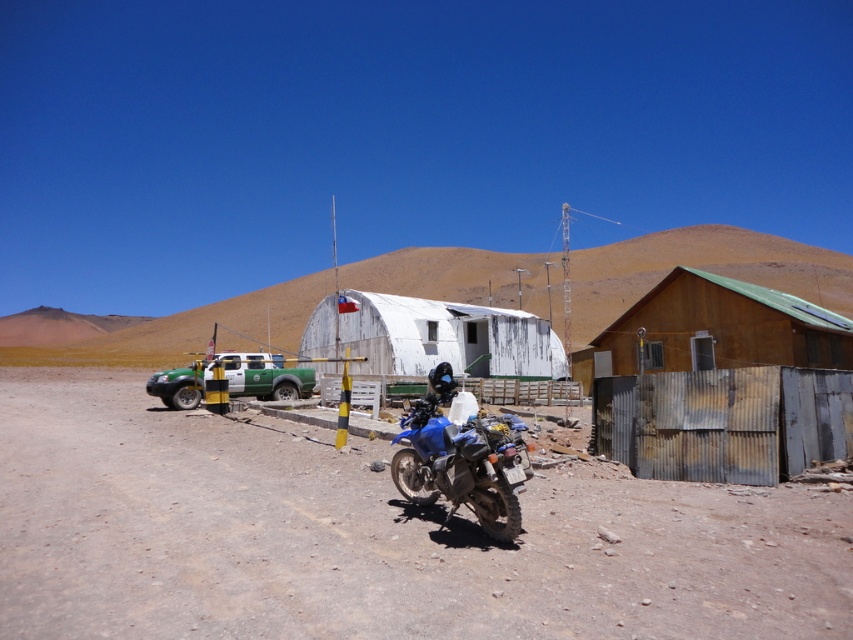
You are a traveler on foot in this desert area. You see the dusty gravel road at center and the blue matte motorcycle at center. Which object is closer to you as you stand on the road?

The dusty gravel road at center is positioned under the blue matte motorcycle at center, so the motorcycle is closer to you than the road.

In the scene shown: You are a delivery driver trying to pass a blue matte motorcycle at center parked on the dusty gravel road at center. Can your truck, which is 2 meters wide, safely pass the motorcycle on the same road?

The dusty gravel road at center might be wider than blue matte motorcycle at center, so there is a possibility that the truck can pass safely if the road width allows. However, without exact measurements, it is uncertain.

You are a delivery driver who needs to park your truck between the white corrugated metal building at center and the blue matte motorcycle at center. Which side of the road should you park on to ensure there is enough space between the truck and the taller object?

The white corrugated metal building at center is much taller than the blue matte motorcycle at center. To ensure enough space between the truck and the taller object, you should park on the side closer to the blue matte motorcycle at center since the building is taller and might require more clearance.